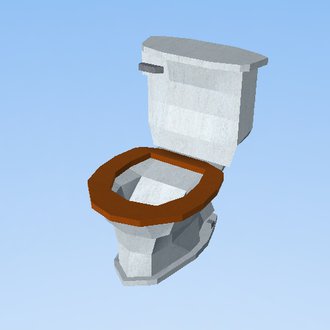
Find the location of a particular element. handle is located at coordinates (145, 68).